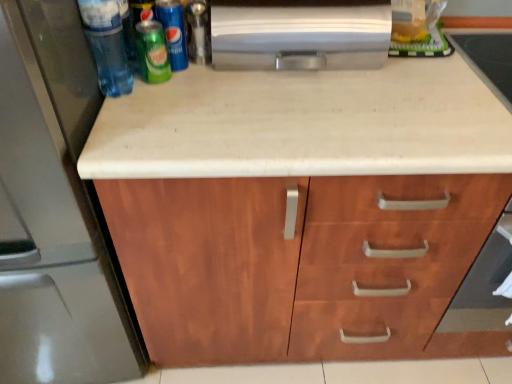
Find the location of a particular element. The width and height of the screenshot is (512, 384). vacant region in front of green matte soda can at upper left, acting as the first beer starting from the left is located at coordinates (159, 120).